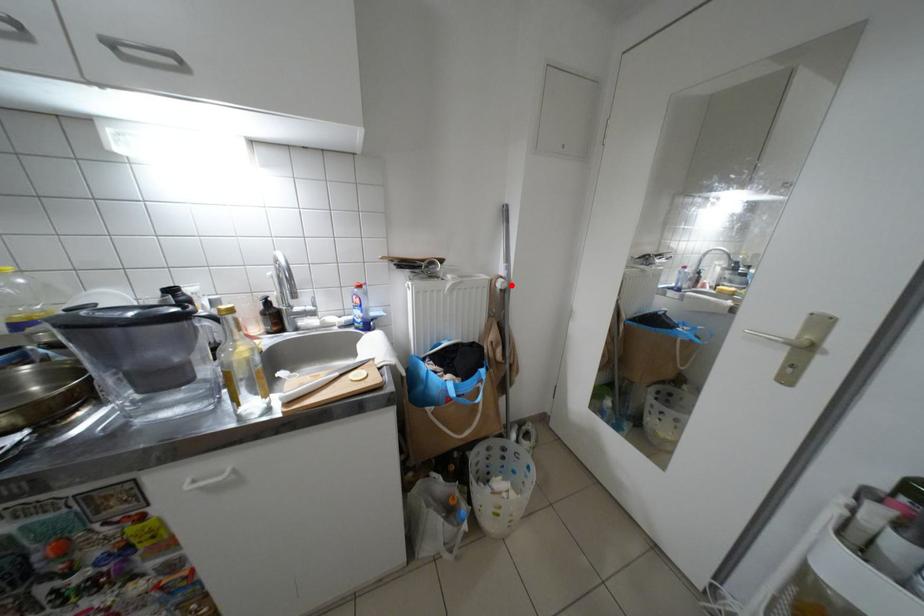
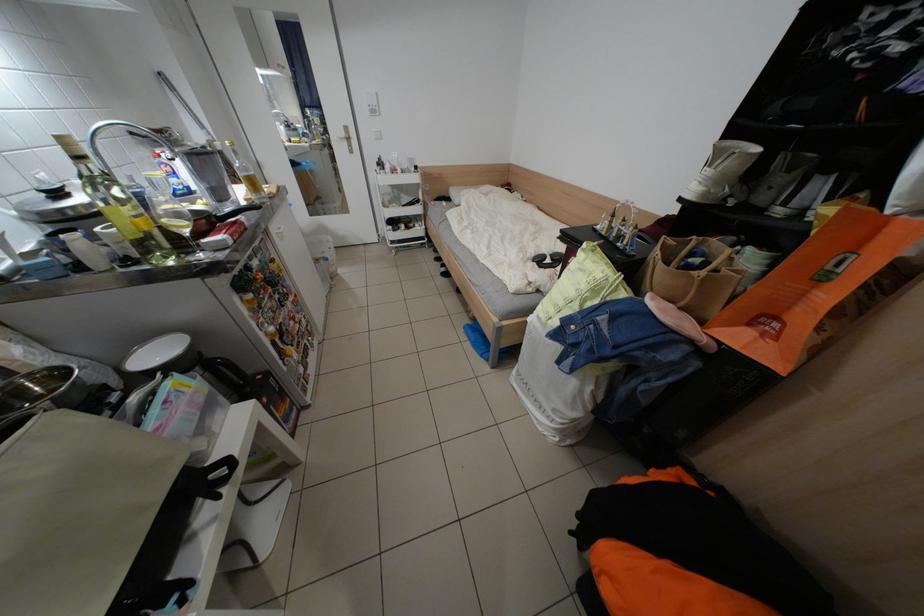
The point at the highlighted location is marked in the first image. Where is the corresponding point in the second image?

(231, 148)